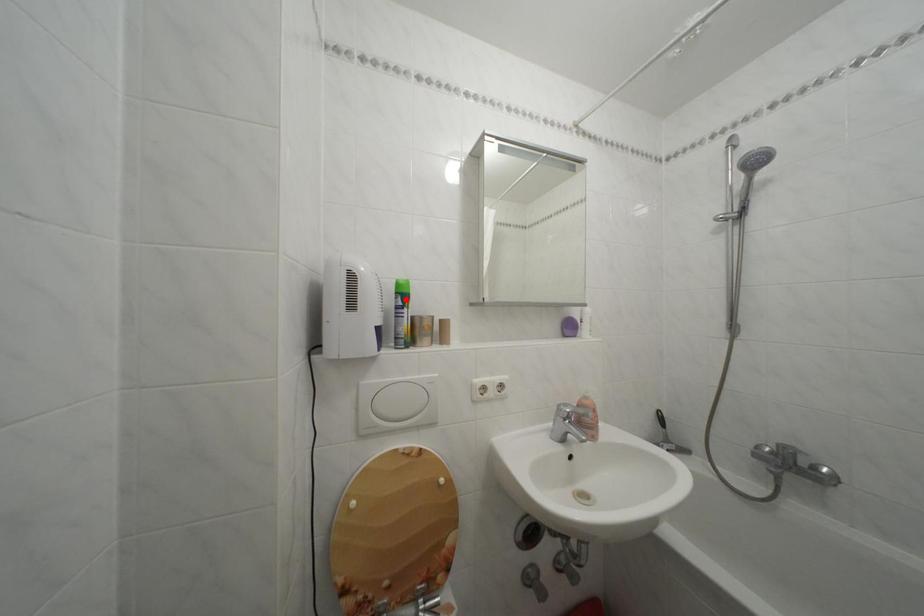
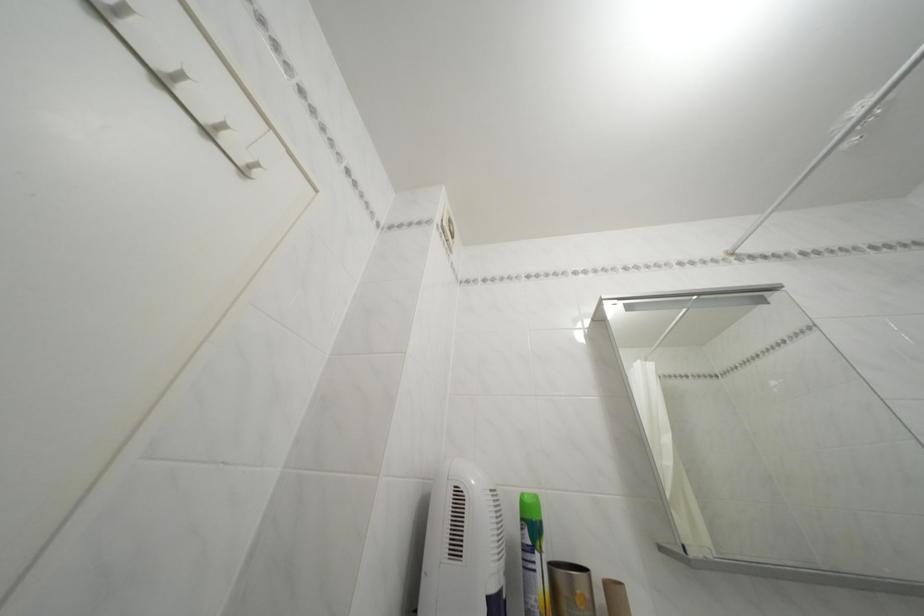
Where in the second image is the point corresponding to the highlighted location from the first image?

(531, 525)